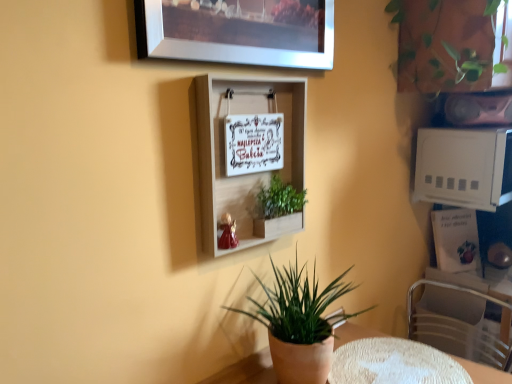
Question: From the image's perspective, is white wooden shelf at center below white plastic microwave at upper right?

Choices:
 (A) yes
 (B) no

Answer: (A)

Question: From the image's perspective, would you say white wooden shelf at center is positioned over white plastic microwave at upper right?

Choices:
 (A) no
 (B) yes

Answer: (A)

Question: Is the depth of white wooden shelf at center less than that of white plastic microwave at upper right?

Choices:
 (A) no
 (B) yes

Answer: (B)

Question: Considering the relative sizes of white wooden shelf at center and white plastic microwave at upper right in the image provided, is white wooden shelf at center smaller than white plastic microwave at upper right?

Choices:
 (A) yes
 (B) no

Answer: (A)

Question: Is white wooden shelf at center shorter than white plastic microwave at upper right?

Choices:
 (A) no
 (B) yes

Answer: (A)

Question: From a real-world perspective, is white wooden shelf at center physically below white plastic microwave at upper right?

Choices:
 (A) no
 (B) yes

Answer: (A)

Question: Is green matte plant pot at lower center, the 1th houseplant ordered from the bottom, placed right next to green leafy plant at upper right, the 3th houseplant in the left-to-right sequence?

Choices:
 (A) no
 (B) yes

Answer: (A)

Question: Considering the relative positions of green matte plant pot at lower center, which is the third houseplant from top to bottom, and green leafy plant at upper right, which is counted as the third houseplant, starting from the bottom, in the image provided, is green matte plant pot at lower center, which is the third houseplant from top to bottom, to the right of green leafy plant at upper right, which is counted as the third houseplant, starting from the bottom, from the viewer's perspective?

Choices:
 (A) yes
 (B) no

Answer: (B)

Question: Does green matte plant pot at lower center, the 1th houseplant ordered from the bottom, lie behind green leafy plant at upper right, the first houseplant viewed from the top?

Choices:
 (A) yes
 (B) no

Answer: (B)

Question: Is green matte plant pot at lower center, marked as the second houseplant in a right-to-left arrangement, thinner than green leafy plant at upper right, the 3th houseplant in the left-to-right sequence?

Choices:
 (A) yes
 (B) no

Answer: (A)

Question: Is green matte plant pot at lower center, marked as the second houseplant in a right-to-left arrangement, outside of green leafy plant at upper right, which is the 1th houseplant in right-to-left order?

Choices:
 (A) no
 (B) yes

Answer: (B)

Question: From a real-world perspective, is metallic silver swivel chair at lower right positioned under white textured table at lower center based on gravity?

Choices:
 (A) yes
 (B) no

Answer: (A)